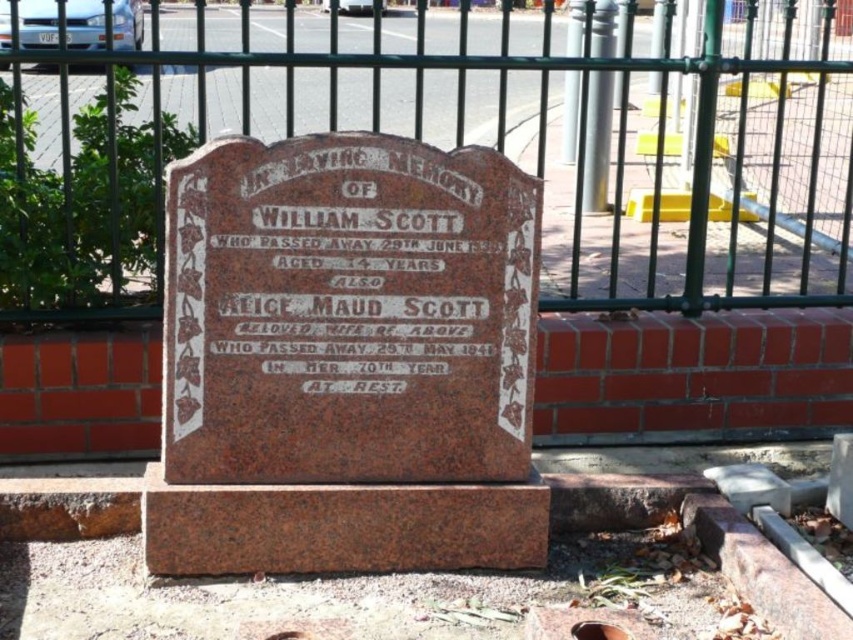
Which is in front, point (219, 250) or point (242, 317)?

Point (219, 250) is in front.

Locate an element on the screen. The width and height of the screenshot is (853, 640). brown polished stone plaque at center is located at coordinates (347, 312).

At what (x,y) coordinates should I click in order to perform the action: click on brown polished stone plaque at center. Please return your answer as a coordinate pair (x, y). Looking at the image, I should click on point(347,312).

Can you confirm if green metal fence at upper center is taller than brown polished stone plaque at center?

Correct, green metal fence at upper center is much taller as brown polished stone plaque at center.

Is point (41, 228) in front of point (364, 353)?

No.

Who is more forward, (451, 12) or (292, 193)?

Point (292, 193) is more forward.

This screenshot has height=640, width=853. Find the location of `green metal fence at upper center`. green metal fence at upper center is located at coordinates (451, 136).

Which is below, green metal fence at upper center or white painted stone at center?

white painted stone at center is lower down.

Who is more forward, (10, 160) or (465, 256)?

Point (465, 256) is in front.

Image resolution: width=853 pixels, height=640 pixels. I want to click on green metal fence at upper center, so click(x=451, y=136).